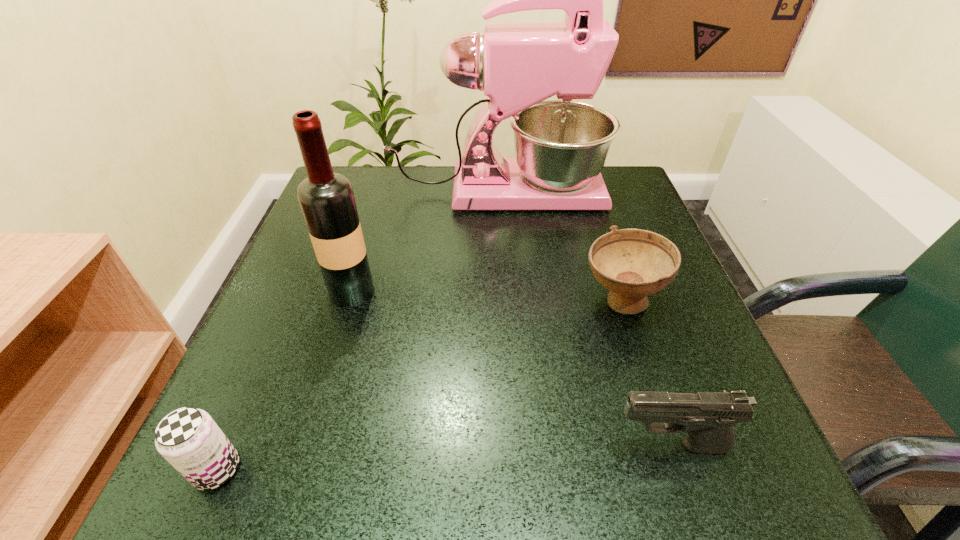
At what (x,y) coordinates should I click in order to perform the action: click on the farthest object. Please return your answer as a coordinate pair (x, y). Looking at the image, I should click on (561, 146).

Where is `the tallest object`? The height and width of the screenshot is (540, 960). the tallest object is located at coordinates (561, 146).

Identify the location of the fourth shortest object. The width and height of the screenshot is (960, 540). (327, 201).

Where is `soup bowl`? soup bowl is located at coordinates (632, 263).

Where is `pistol`? The height and width of the screenshot is (540, 960). pistol is located at coordinates (708, 417).

Where is `the leftmost object`? The height and width of the screenshot is (540, 960). the leftmost object is located at coordinates (189, 439).

You are a GUI agent. You are given a task and a screenshot of the screen. Output one action in this format:
    pyautogui.click(x=<x>, y=<y>)
    Task: Click on the vacant position located on the face of the mixer
    Image resolution: width=960 pixels, height=540 pixels.
    Given the screenshot: What is the action you would take?
    pyautogui.click(x=636, y=192)

Identify the location of free space located 0.170m on the right of the wine bottle. This screenshot has height=540, width=960. (464, 291).

The height and width of the screenshot is (540, 960). What are the coordinates of `vacant space situated on the left of the soup bowl` in the screenshot? It's located at (434, 301).

Image resolution: width=960 pixels, height=540 pixels. Identify the location of vacant region located 0.300m at the barrel of the pistol. (396, 446).